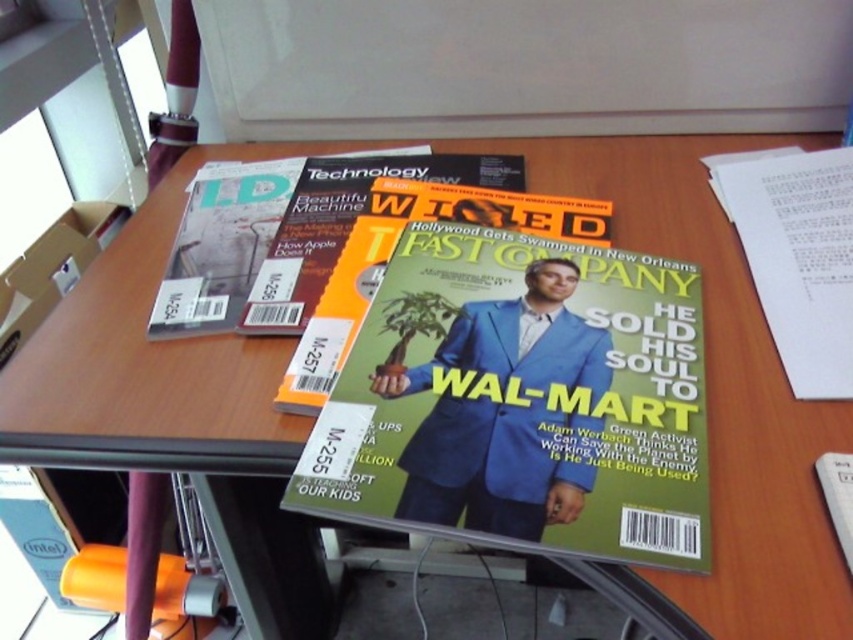
Question: Which point is closer to the camera taking this photo?

Choices:
 (A) tap(563, 326)
 (B) tap(259, 193)

Answer: (A)

Question: Which point is closer to the camera?

Choices:
 (A) matte orange magazine at center
 (B) green matte magazine at center

Answer: (B)

Question: Is green matte magazine at center below blue fabric man at center?

Choices:
 (A) yes
 (B) no

Answer: (B)

Question: In this image, where is green matte magazine at center located relative to blue fabric man at center?

Choices:
 (A) below
 (B) above

Answer: (B)

Question: Is green matte magazine at center to the right of blue fabric man at center from the viewer's perspective?

Choices:
 (A) no
 (B) yes

Answer: (B)

Question: Which of these objects is positioned closest to the blue fabric man at center?

Choices:
 (A) green matte magazine at center
 (B) matte orange magazine at center

Answer: (A)